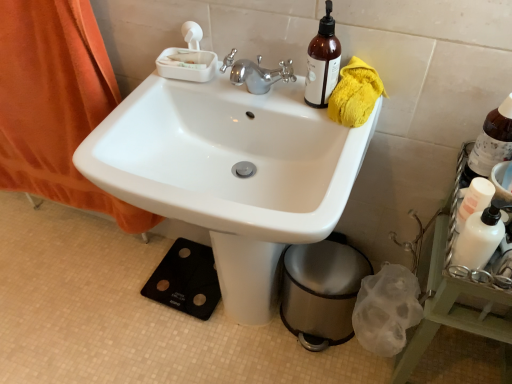
You are a GUI agent. You are given a task and a screenshot of the screen. Output one action in this format:
    pyautogui.click(x=<x>, y=<y>)
    Task: Click on the vacant area that lies in front of orange fabric curtain at left
    Image resolution: width=512 pixels, height=384 pixels.
    Given the screenshot: What is the action you would take?
    pyautogui.click(x=75, y=295)